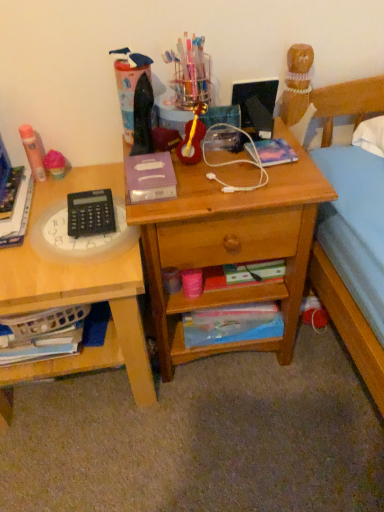
Identify the location of vacant space that is to the left of multicolored fabric book at center, which ranks as the 2th paperback book in front-to-back order. (208, 158).